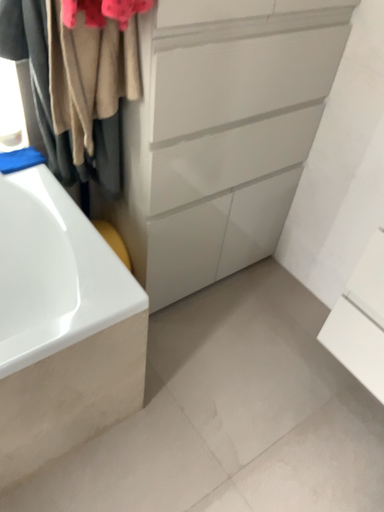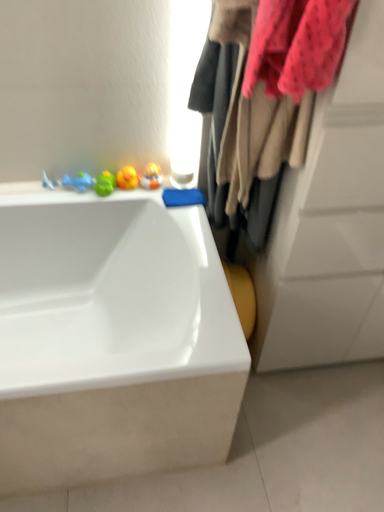
Question: Which way did the camera rotate in the video?

Choices:
 (A) rotated downward
 (B) rotated upward

Answer: (B)